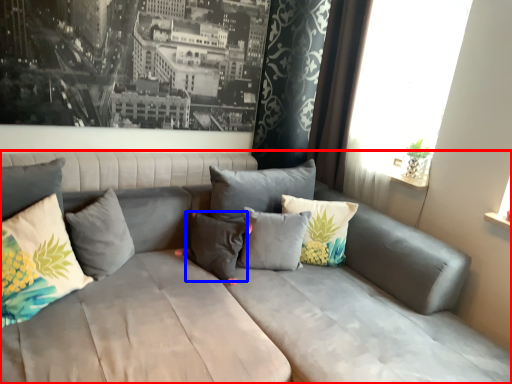
Question: Which of the following is the closest to the observer, studio couch (highlighted by a red box) or pillow (highlighted by a blue box)?

Choices:
 (A) studio couch
 (B) pillow

Answer: (A)